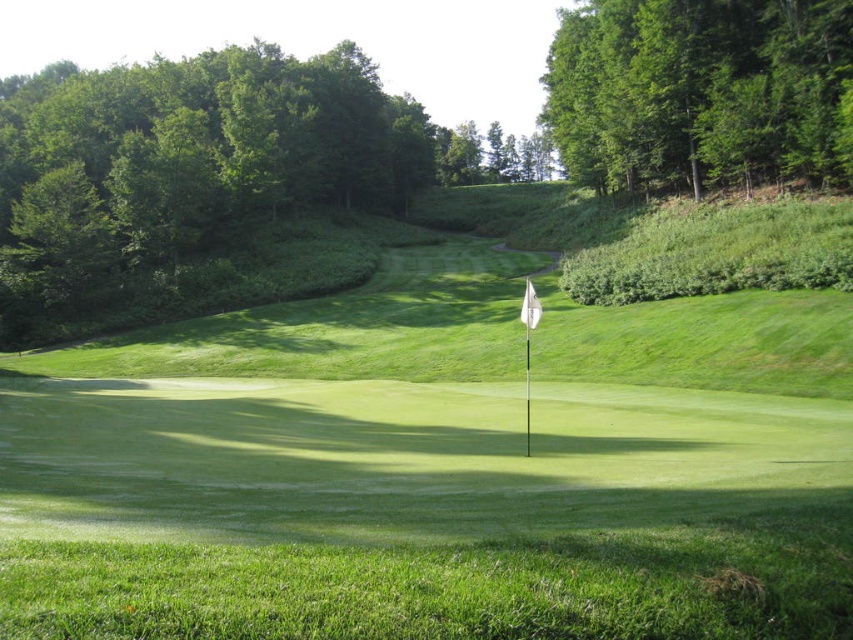
You are a golfer standing on the fairway and want to hit your ball towards the green grass flag at center. There is a green leafy tree at upper right in your way. Based on their positions, which direction should you aim to avoid hitting the tree?

The green grass flag at center is positioned on the left side of the green leafy tree at upper right, so you should aim to the left of the tree to reach the flag without hitting it.

You are a golfer standing on the fairway and want to align your putt towards the hole marked by the green grass flag at center. However, you notice a green leafy tree at upper right in your line of sight. Which object is larger and might obstruct your view of the flag?

The green grass flag at center is bigger than the green leafy tree at upper right, so the flag itself is larger and might obstruct your view of the tree, but the tree could still partially block the flag depending on its position.

From the picture: You are a golfer standing on the green and want to hit your ball into the hole marked by the green grass flag at center. There is a green leafy tree at upper right in the background. Will the tree block your view of the flag when you aim your shot?

The green leafy tree at upper right is taller than the green grass flag at center, so it might block your view depending on the distance and angle. However, since the flag is at the center of the green and the tree is at the upper right, it might not directly obstruct the line of sight unless you are positioned in a specific spot on the green.